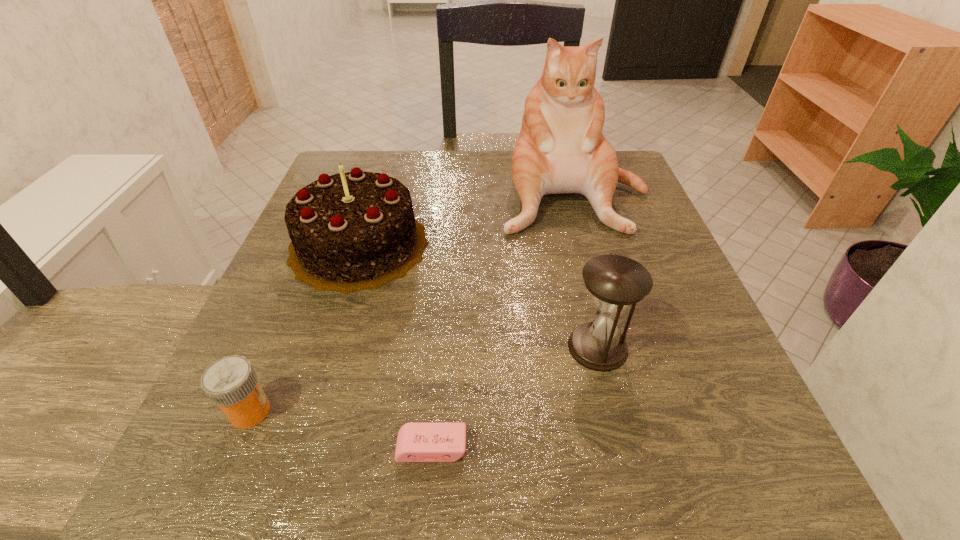
I want to click on vacant area located 0.080m on the front of the third tallest object, so click(615, 421).

This screenshot has height=540, width=960. I want to click on vacant space located on the label side of the fourth farthest object, so click(x=499, y=411).

I want to click on vacant space located on the right of the eraser, so click(588, 448).

Locate an element on the screen. This screenshot has height=540, width=960. object that is at the far edge is located at coordinates (561, 149).

The height and width of the screenshot is (540, 960). I want to click on object present at the near edge, so click(417, 442).

The height and width of the screenshot is (540, 960). What are the coordinates of `birthday cake that is at the left edge` in the screenshot? It's located at (353, 231).

Find the location of `medicine at the left edge`. medicine at the left edge is located at coordinates (231, 382).

Find the location of a particular element. cat present at the right edge is located at coordinates (561, 149).

At what (x,y) coordinates should I click in order to perform the action: click on hourglass at the right edge. Please return your answer as a coordinate pair (x, y). This screenshot has width=960, height=540. Looking at the image, I should click on (616, 282).

Where is `object present at the far right corner`? object present at the far right corner is located at coordinates (561, 149).